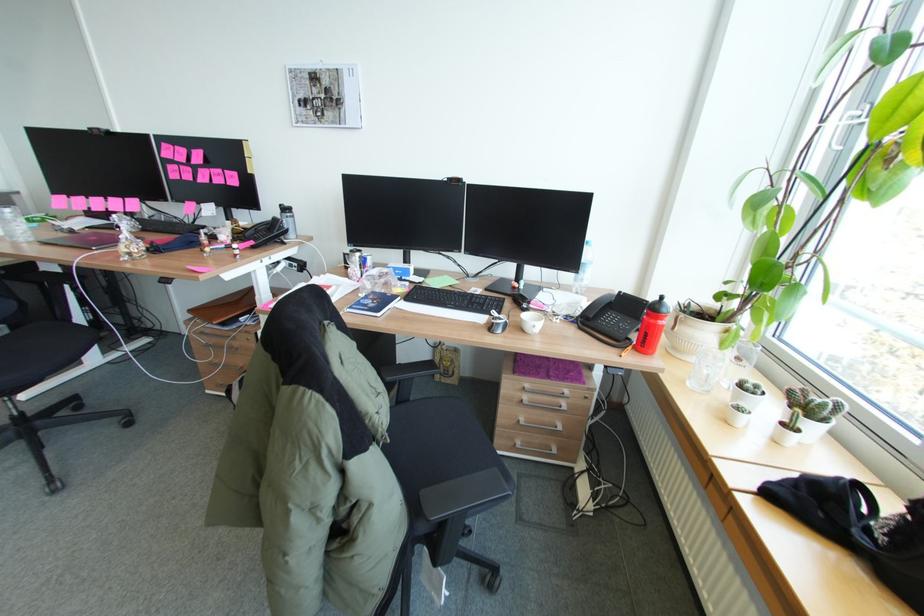
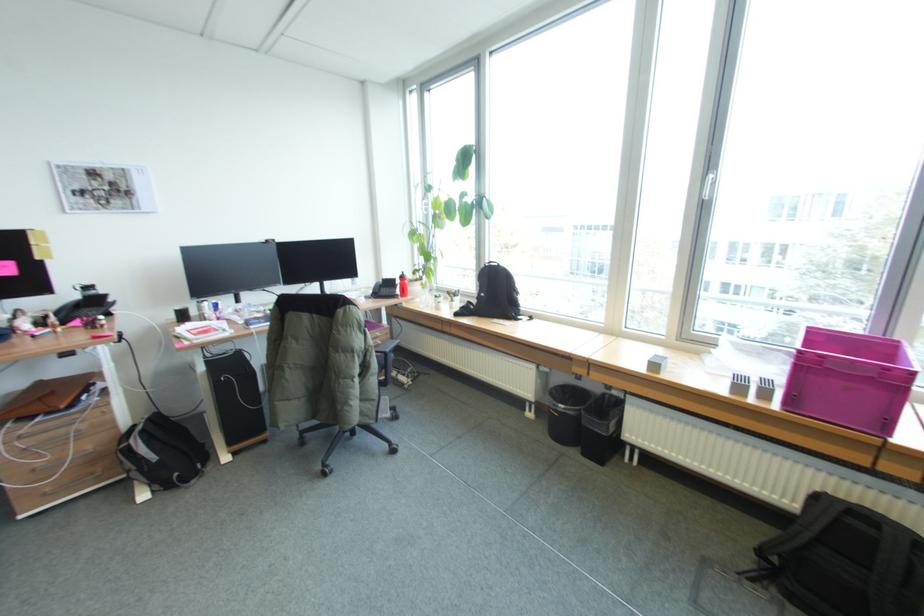
The point at [573,315] is marked in the first image. Where is the corresponding point in the second image?

(370, 297)